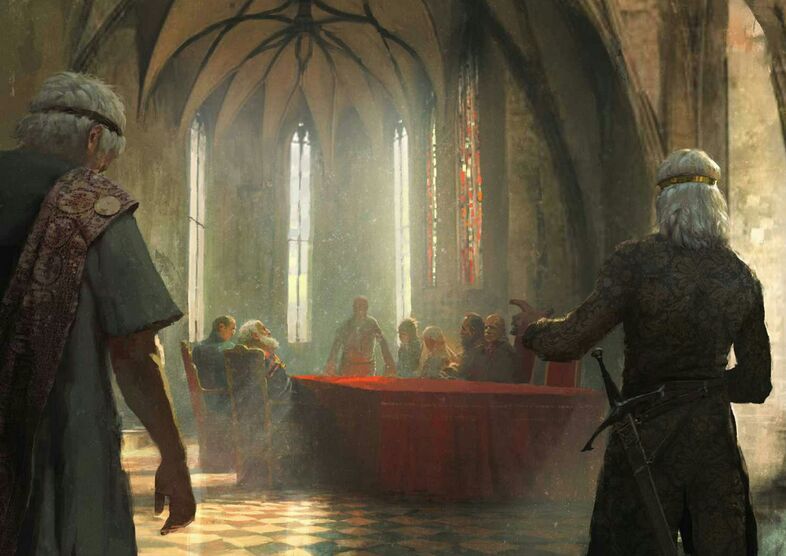
Image resolution: width=786 pixels, height=556 pixels. What are the coordinates of `handle` in the screenshot? It's located at (615, 392).